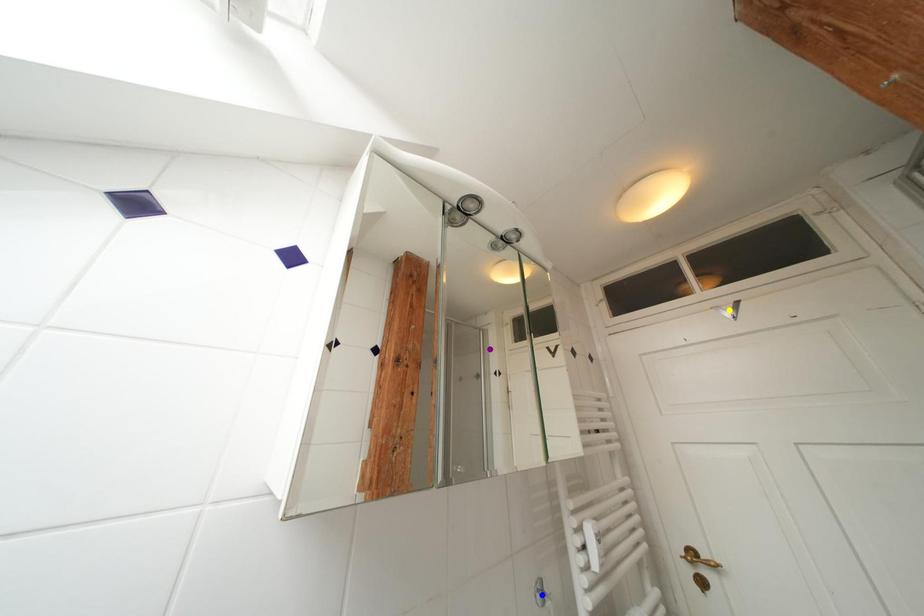
Order these from nearest to farthest:
- yellow point
- purple point
- blue point

blue point
yellow point
purple point